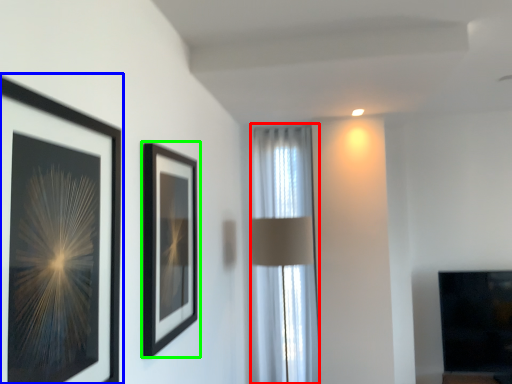
Question: Considering the real-world distances, which object is farthest from curtain (highlighted by a red box)? picture frame (highlighted by a blue box) or picture frame (highlighted by a green box)?

Choices:
 (A) picture frame
 (B) picture frame

Answer: (A)